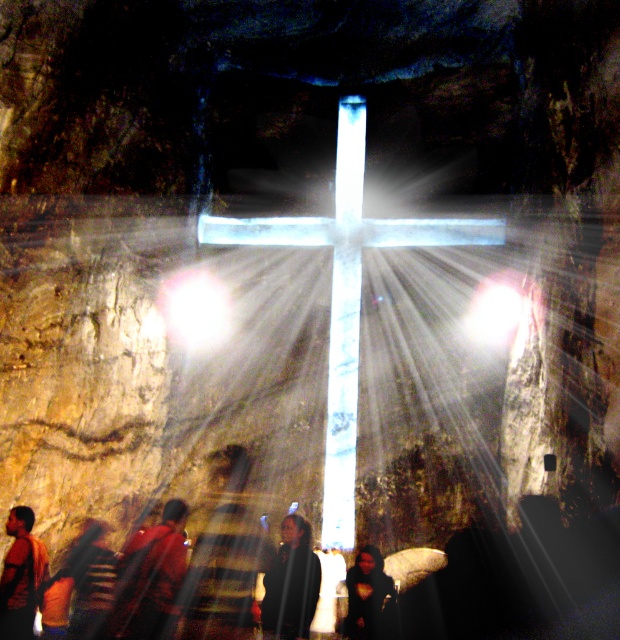
Question: Observing the image, what is the correct spatial positioning of red fabric backpack at lower left in reference to bright white light at center?

Choices:
 (A) right
 (B) left

Answer: (B)

Question: Which object appears farthest from the camera in this image?

Choices:
 (A) illuminated glass cross at center
 (B) dark brown leather jacket at lower left
 (C) striped fabric shirt at lower center
 (D) red fabric backpack at lower left

Answer: (A)

Question: Where is dark hair at center located in relation to dark brown leather jacket at lower left in the image?

Choices:
 (A) right
 (B) left

Answer: (A)

Question: Does illuminated glass cross at center appear over bright white light at center?

Choices:
 (A) yes
 (B) no

Answer: (B)

Question: Based on their relative distances, which object is farther from the bright white light at center?

Choices:
 (A) striped fabric shirt at lower center
 (B) dark matte clothing at center

Answer: (B)

Question: Which point is farther to the camera?

Choices:
 (A) (210, 593)
 (B) (146, 579)
 (C) (355, 636)

Answer: (A)